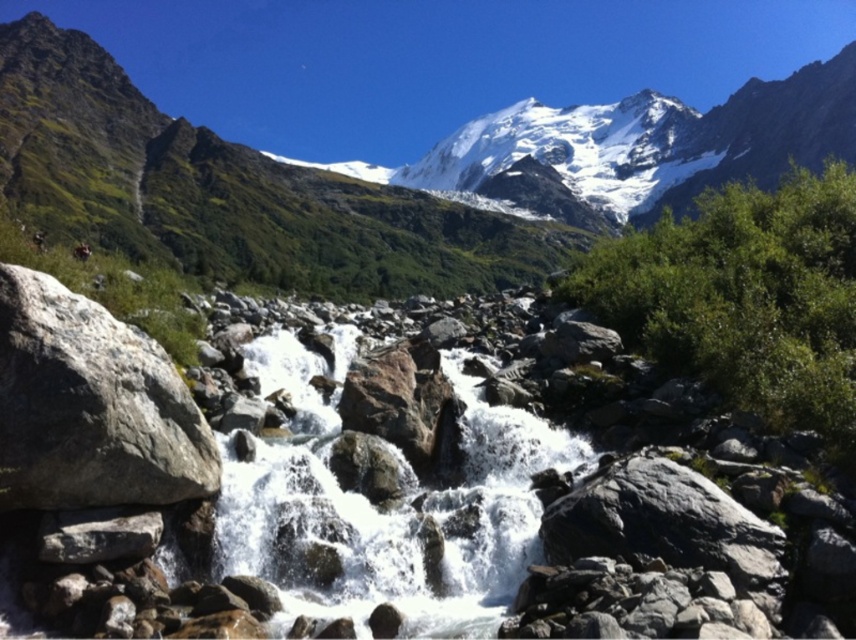
Is point (259, 486) less distant than point (93, 371)?

No, (259, 486) is further to viewer.

Based on the photo, does white frothy water at center have a larger size compared to gray rough rock at left?

Indeed, white frothy water at center has a larger size compared to gray rough rock at left.

The image size is (856, 640). In order to click on white frothy water at center in this screenshot , I will do tap(381, 508).

Does white snow-covered mountain at center have a larger size compared to white frothy water at center?

Yes, white snow-covered mountain at center is bigger than white frothy water at center.

Which of these two, white snow-covered mountain at center or white frothy water at center, stands taller?

white snow-covered mountain at center

Between point (432, 266) and point (476, 428), which one is positioned behind?

The point (432, 266) is more distant.

This screenshot has height=640, width=856. I want to click on white snow-covered mountain at center, so click(248, 192).

Is white snow-covered mountain at center behind gray rough rock at left?

Yes, it is.

Who is more distant from viewer, (786, 145) or (100, 381)?

Point (786, 145)

Where is `white snow-covered mountain at center`? The height and width of the screenshot is (640, 856). white snow-covered mountain at center is located at coordinates point(248,192).